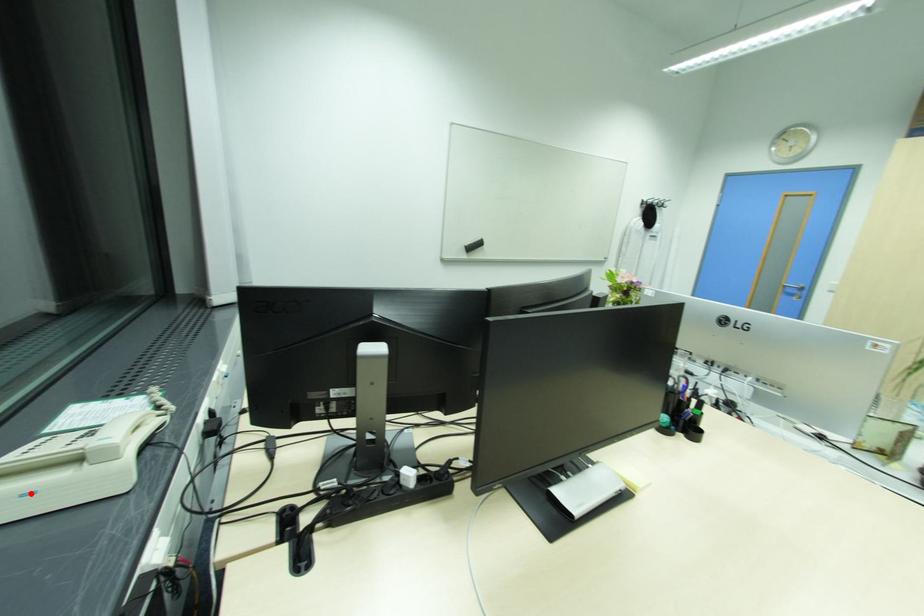
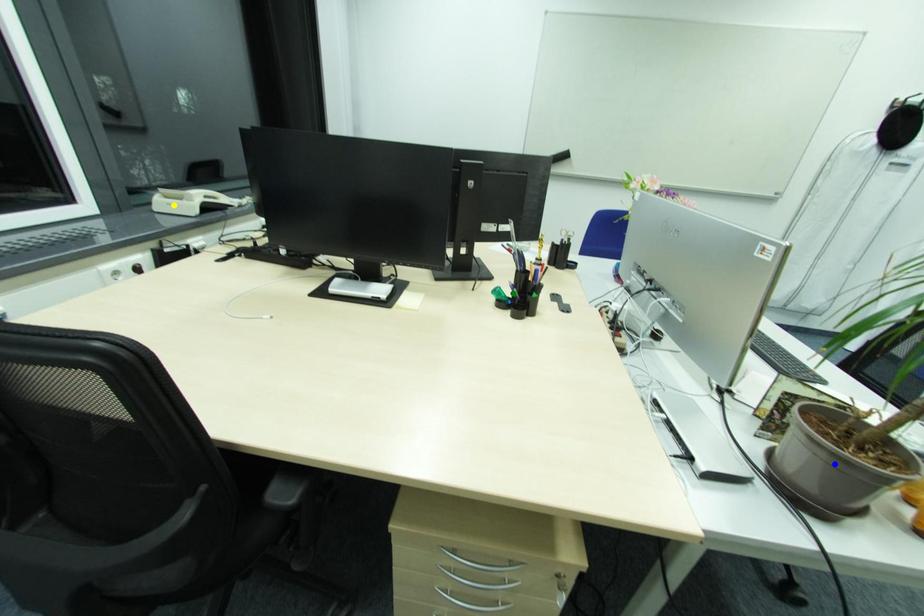
Question: I am providing you with two images of the same scene from different viewpoints. A red point is marked on the first image. You are given multiple points on the second image. In image 2, which mark is for the same physical point as the one in image 1?

Choices:
 (A) blue point
 (B) green point
 (C) yellow point

Answer: (C)